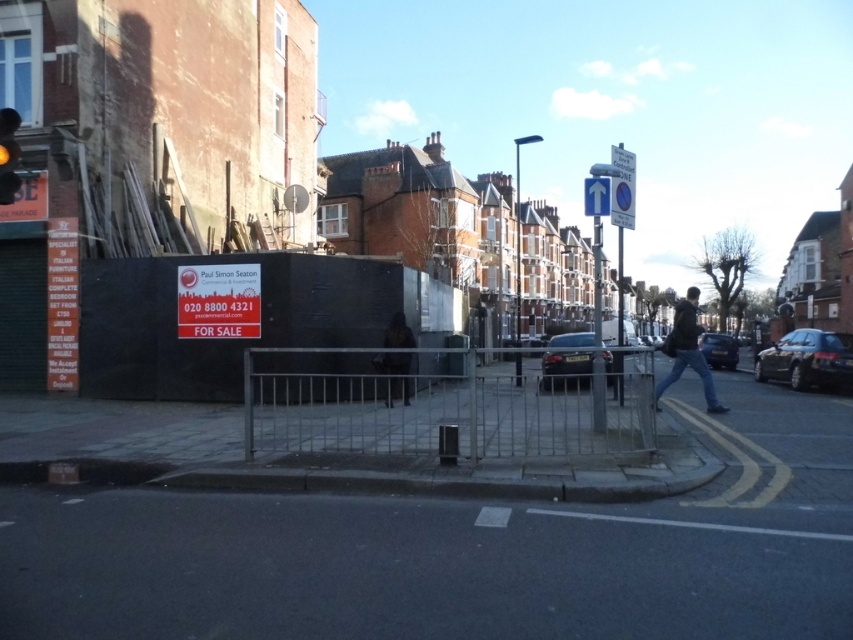
Question: Estimate the real-world distances between objects in this image. Which object is farther from the dark gray jacket at center right?

Choices:
 (A) shiny black car at lower right
 (B) shiny black car at right
 (C) black metallic car at center

Answer: (C)

Question: Estimate the real-world distances between objects in this image. Which object is closer to the dark gray jacket at center right?

Choices:
 (A) blue circular sign at upper center
 (B) shiny black car at lower right
 (C) shiny black car at right

Answer: (B)

Question: In this image, where is black metallic car at center located relative to dark brown fur coat at center?

Choices:
 (A) left
 (B) right

Answer: (B)

Question: Which of the following is the farthest from the observer?

Choices:
 (A) (613, 177)
 (B) (552, 358)
 (C) (386, 353)

Answer: (B)

Question: Does blue circular sign at upper center appear under white plastic sign at upper center?

Choices:
 (A) no
 (B) yes

Answer: (A)

Question: Does silver metallic fence at center have a lesser width compared to dark gray jacket at center right?

Choices:
 (A) yes
 (B) no

Answer: (A)